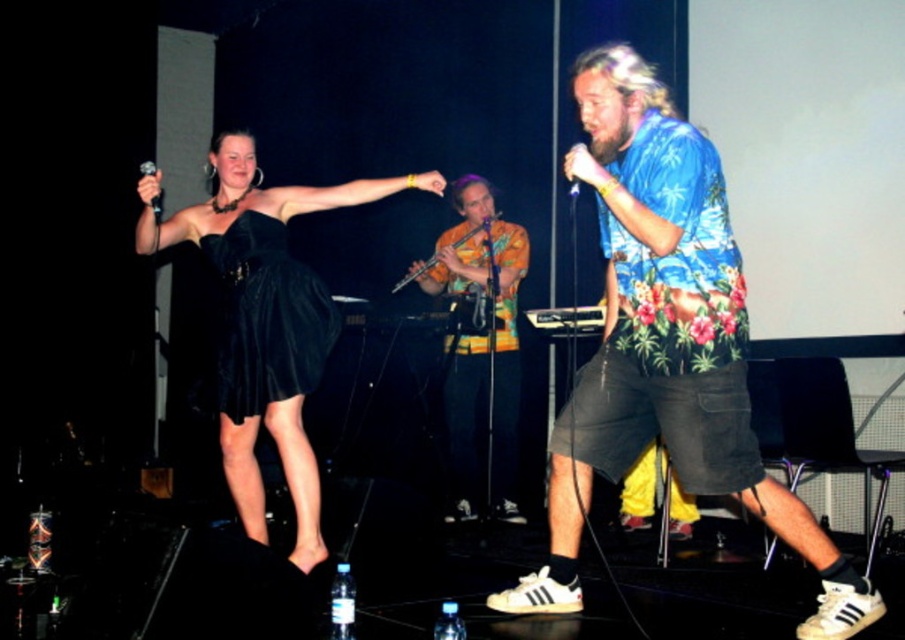
Is black velvet dress at center positioned behind matte black microphone at center?

Yes, it is.

Which is more to the right, black velvet dress at center or matte black microphone at center?

matte black microphone at center

Locate an element on the screen. This screenshot has height=640, width=905. black velvet dress at center is located at coordinates (265, 317).

Is black satin dress at upper left smaller than wooden flute at center?

Actually, black satin dress at upper left might be larger than wooden flute at center.

Can you confirm if black satin dress at upper left is wider than wooden flute at center?

Yes.

Is point (224, 278) positioned behind point (459, 241)?

No, it is not.

Identify the location of black satin dress at upper left. [x=265, y=321].

Who is more forward, (469, 230) or (150, 173)?

Positioned in front is point (150, 173).

Which is more to the right, wooden flute at center or metallic silver microphone at upper left?

wooden flute at center

Which is behind, point (396, 284) or point (157, 212)?

The point (396, 284) is behind.

Locate an element on the screen. wooden flute at center is located at coordinates (415, 273).